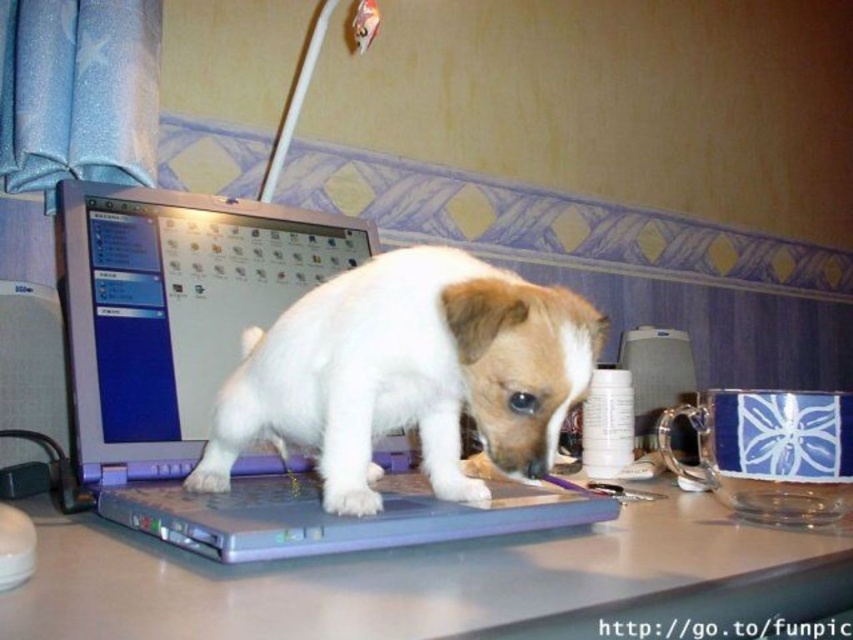
Question: Does gray plastic laptop at center come in front of white fur dog at center?

Choices:
 (A) no
 (B) yes

Answer: (B)

Question: Which point is closer to the camera?

Choices:
 (A) click(x=252, y=272)
 (B) click(x=311, y=324)
 (C) click(x=437, y=570)

Answer: (C)

Question: Which is nearer to the satin silver laptop at center?

Choices:
 (A) white fur dog at center
 (B) gray plastic laptop at center

Answer: (A)

Question: Is white fur dog at center bigger than satin silver laptop at center?

Choices:
 (A) yes
 (B) no

Answer: (B)

Question: Does white fur dog at center appear under satin silver laptop at center?

Choices:
 (A) yes
 (B) no

Answer: (A)

Question: Which is nearer to the satin silver laptop at center?

Choices:
 (A) white fur dog at center
 (B) gray plastic laptop at center

Answer: (A)